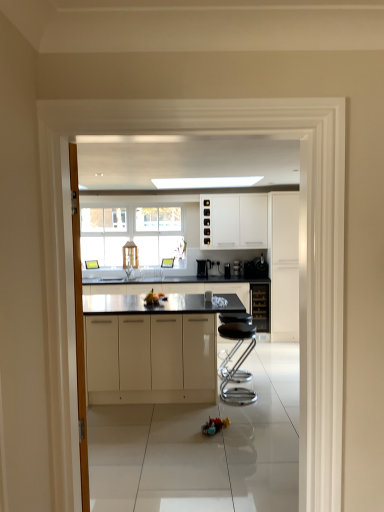
Locate an element on the screen. This screenshot has width=384, height=512. white glossy cabinet at right, which is the 1th cabinetry from right to left is located at coordinates (284, 265).

What is the approximate height of glossy white cabinets at center, the 4th cabinetry when ordered from right to left?

36.18 inches.

You are a GUI agent. You are given a task and a screenshot of the screen. Output one action in this format:
    pyautogui.click(x=<x>, y=<y>)
    Task: Click on the white glossy cabinet at right, which is the 1th cabinetry from right to left
    Image resolution: width=384 pixels, height=512 pixels.
    Given the screenshot: What is the action you would take?
    pyautogui.click(x=284, y=265)

Considering the relative sizes of satin black coffee maker at center, which is counted as the second appliance, starting from the right, and satin black coffee maker at center, the second appliance in the left-to-right sequence, in the image provided, is satin black coffee maker at center, which is counted as the second appliance, starting from the right, bigger than satin black coffee maker at center, the second appliance in the left-to-right sequence,?

Correct, satin black coffee maker at center, which is counted as the second appliance, starting from the right, is larger in size than satin black coffee maker at center, the second appliance in the left-to-right sequence.

Could you tell me if satin black coffee maker at center, acting as the first appliance starting from the left, is turned towards satin black coffee maker at center, the second appliance in the left-to-right sequence?

No, satin black coffee maker at center, acting as the first appliance starting from the left, does not turn towards satin black coffee maker at center, the second appliance in the left-to-right sequence.

Identify the location of the 1st cabinetry positioned below the white glossy cabinet at right, which is the 1th cabinetry from right to left (from a real-world perspective). (260, 306).

Is white glossy cabinet at right, which is the 1th cabinetry from right to left, positioned with its back to black glass wine cooler at center, which is counted as the third cabinetry, starting from the front?

No, white glossy cabinet at right, which is the 1th cabinetry from right to left,'s orientation is not away from black glass wine cooler at center, which is counted as the third cabinetry, starting from the front.

Is white glossy cabinet at right, which is the 1th cabinetry from right to left, not within black glass wine cooler at center, marked as the 2th cabinetry in a back-to-front arrangement?

Absolutely, white glossy cabinet at right, which is the 1th cabinetry from right to left, is external to black glass wine cooler at center, marked as the 2th cabinetry in a back-to-front arrangement.

Can you confirm if white glossy cabinet at right, which is the second cabinetry from front to back, is taller than black glass wine cooler at center, arranged as the 3th cabinetry when viewed from the left?

Yes.

In the scene shown: Can satin black coffee machine at center be found inside white glossy cabinet at right, which is the 4th cabinetry from left to right?

No.

From the image's perspective, relative to satin black coffee machine at center, is white glossy cabinet at right, which is the 1th cabinetry from right to left, above or below?

white glossy cabinet at right, which is the 1th cabinetry from right to left, is situated higher than satin black coffee machine at center in the image.

How far apart are white glossy cabinet at right, which is the 1th cabinetry from right to left, and satin black coffee machine at center?

white glossy cabinet at right, which is the 1th cabinetry from right to left, is 74.40 centimeters away from satin black coffee machine at center.

Which is behind, satin black coffee maker at center, arranged as the first appliance when viewed from the right, or white glossy cabinets at upper center, which appears as the 3th cabinetry when viewed from the right?

satin black coffee maker at center, arranged as the first appliance when viewed from the right, is behind.

How many degrees apart are the facing directions of satin black coffee maker at center, the second appliance in the left-to-right sequence, and white glossy cabinets at upper center, which ranks as the second cabinetry in left-to-right order?

0.744 degrees.

Is satin black coffee maker at center, the second appliance in the left-to-right sequence, aimed at white glossy cabinets at upper center, which appears as the 3th cabinetry when viewed from the right?

No, satin black coffee maker at center, the second appliance in the left-to-right sequence, is not aimed at white glossy cabinets at upper center, which appears as the 3th cabinetry when viewed from the right.

From the image's perspective, is satin black coffee maker at center, the second appliance in the left-to-right sequence, beneath white glossy cabinets at upper center, arranged as the 1th cabinetry when viewed from the back?

Correct, satin black coffee maker at center, the second appliance in the left-to-right sequence, appears lower than white glossy cabinets at upper center, arranged as the 1th cabinetry when viewed from the back, in the image.

Based on the photo, which is more to the left, white glossy cabinets at upper center, arranged as the 1th cabinetry when viewed from the back, or satin black coffee maker at center, which is counted as the second appliance, starting from the right?

satin black coffee maker at center, which is counted as the second appliance, starting from the right, is more to the left.

Between white glossy cabinets at upper center, which ranks as the second cabinetry in left-to-right order, and satin black coffee maker at center, which is counted as the second appliance, starting from the right, which one has more height?

With more height is white glossy cabinets at upper center, which ranks as the second cabinetry in left-to-right order.

Which appliance is the 2nd one when counting from the back of the white glossy cabinets at upper center, which ranks as the second cabinetry in left-to-right order? Please provide its 2D coordinates.

[(204, 267)]

From the image's perspective, which one is positioned lower, white glossy cabinets at upper center, which ranks as the 4th cabinetry in front-to-back order, or satin black coffee maker at center, which is counted as the second appliance, starting from the right?

satin black coffee maker at center, which is counted as the second appliance, starting from the right, from the image's perspective.

Is satin black coffee maker at center, acting as the first appliance starting from the left, further to the viewer compared to metallic silver bar stool at center?

Yes, satin black coffee maker at center, acting as the first appliance starting from the left, is behind metallic silver bar stool at center.

Can you confirm if satin black coffee maker at center, which is counted as the second appliance, starting from the right, is shorter than metallic silver bar stool at center?

Yes, satin black coffee maker at center, which is counted as the second appliance, starting from the right, is shorter than metallic silver bar stool at center.

How different are the orientations of satin black coffee maker at center, which is counted as the second appliance, starting from the right, and metallic silver bar stool at center in degrees?

satin black coffee maker at center, which is counted as the second appliance, starting from the right, and metallic silver bar stool at center are facing 96.5 degrees away from each other.

Between satin black coffee maker at center, which is counted as the second appliance, starting from the right, and metallic silver bar stool at center, which one has smaller size?

Smaller between the two is satin black coffee maker at center, which is counted as the second appliance, starting from the right.

Is point (255, 272) positioned behind point (106, 327)?

Yes, point (255, 272) is farther from viewer.

Considering their positions, is satin black coffee maker at center, arranged as the first appliance when viewed from the right, located in front of or behind glossy white cabinets at center, positioned as the 4th cabinetry in back-to-front order?

satin black coffee maker at center, arranged as the first appliance when viewed from the right, is behind glossy white cabinets at center, positioned as the 4th cabinetry in back-to-front order.

Considering the relative sizes of satin black coffee maker at center, the second appliance in the left-to-right sequence, and glossy white cabinets at center, positioned as the 4th cabinetry in back-to-front order, in the image provided, is satin black coffee maker at center, the second appliance in the left-to-right sequence, bigger than glossy white cabinets at center, positioned as the 4th cabinetry in back-to-front order,?

No, satin black coffee maker at center, the second appliance in the left-to-right sequence, is not bigger than glossy white cabinets at center, positioned as the 4th cabinetry in back-to-front order.

Locate an element on the screen. The image size is (384, 512). appliance in front of the satin black coffee maker at center, acting as the first appliance starting from the left is located at coordinates (249, 269).

The width and height of the screenshot is (384, 512). What are the coordinates of `the 1st cabinetry positioned above the black glass wine cooler at center, marked as the 2th cabinetry in a back-to-front arrangement (from the image's perspective)` in the screenshot? It's located at (284, 265).

From the image, which object appears to be nearer to satin black coffee maker at center, acting as the first appliance starting from the left, metallic silver bar stool at center or satin black coffee machine at center?

Among the two, satin black coffee machine at center is located nearer to satin black coffee maker at center, acting as the first appliance starting from the left.

From the picture: Estimate the real-world distances between objects in this image. Which object is further from white glossy cabinets at upper center, which ranks as the 4th cabinetry in front-to-back order, satin black coffee machine at center or black glass wine cooler at center, which appears as the second cabinetry when viewed from the right?

The object further to white glossy cabinets at upper center, which ranks as the 4th cabinetry in front-to-back order, is black glass wine cooler at center, which appears as the second cabinetry when viewed from the right.

From the image, which object appears to be nearer to satin black coffee maker at center, the second appliance in the left-to-right sequence, glossy white cabinets at center, the 1th cabinetry in the left-to-right sequence, or satin black coffee machine at center?

satin black coffee machine at center is positioned closer to the anchor satin black coffee maker at center, the second appliance in the left-to-right sequence.

Based on their spatial positions, is glossy white cabinets at center, positioned as the 4th cabinetry in back-to-front order, or white glossy cabinet at right, the 3th cabinetry when ordered from back to front, closer to metallic silver bar stool at center?

glossy white cabinets at center, positioned as the 4th cabinetry in back-to-front order, is closer to metallic silver bar stool at center.

Based on their spatial positions, is black glass wine cooler at center, arranged as the 3th cabinetry when viewed from the left, or metallic silver bar stool at center further from glossy white cabinets at center, positioned as the 4th cabinetry in back-to-front order?

Among the two, black glass wine cooler at center, arranged as the 3th cabinetry when viewed from the left, is located further to glossy white cabinets at center, positioned as the 4th cabinetry in back-to-front order.

Looking at the image, which one is located closer to black glass wine cooler at center, marked as the 2th cabinetry in a back-to-front arrangement, metallic silver bar stool at center or white glossy cabinets at upper center, which ranks as the second cabinetry in left-to-right order?

Based on the image, white glossy cabinets at upper center, which ranks as the second cabinetry in left-to-right order, appears to be nearer to black glass wine cooler at center, marked as the 2th cabinetry in a back-to-front arrangement.

Based on the photo, from the image, which object appears to be farther from glossy white cabinets at center, positioned as the 4th cabinetry in back-to-front order, white glossy cabinets at upper center, which ranks as the 4th cabinetry in front-to-back order, or metallic silver bar stool at center?

Based on the image, white glossy cabinets at upper center, which ranks as the 4th cabinetry in front-to-back order, appears to be further to glossy white cabinets at center, positioned as the 4th cabinetry in back-to-front order.

From the image, which object appears to be nearer to glossy white cabinets at center, the 1th cabinetry in the left-to-right sequence, satin black coffee machine at center or satin black coffee maker at center, acting as the first appliance starting from the left?

Based on the image, satin black coffee maker at center, acting as the first appliance starting from the left, appears to be nearer to glossy white cabinets at center, the 1th cabinetry in the left-to-right sequence.

I want to click on appliance between satin black coffee maker at center, acting as the first appliance starting from the left, and black glass wine cooler at center, marked as the 2th cabinetry in a back-to-front arrangement, from left to right, so click(x=249, y=269).

This screenshot has height=512, width=384. I want to click on coffee machine between white glossy cabinets at upper center, which appears as the 3th cabinetry when viewed from the right, and white glossy cabinet at right, which is the 4th cabinetry from left to right, so click(237, 267).

Where is `appliance between white glossy cabinets at upper center, which appears as the 3th cabinetry when viewed from the right, and white glossy cabinet at right, which is the 1th cabinetry from right to left, in the horizontal direction`? This screenshot has width=384, height=512. appliance between white glossy cabinets at upper center, which appears as the 3th cabinetry when viewed from the right, and white glossy cabinet at right, which is the 1th cabinetry from right to left, in the horizontal direction is located at coordinates (249, 269).

Locate an element on the screen. The width and height of the screenshot is (384, 512). appliance between metallic silver bar stool at center and satin black coffee maker at center, acting as the first appliance starting from the left, from front to back is located at coordinates (249, 269).